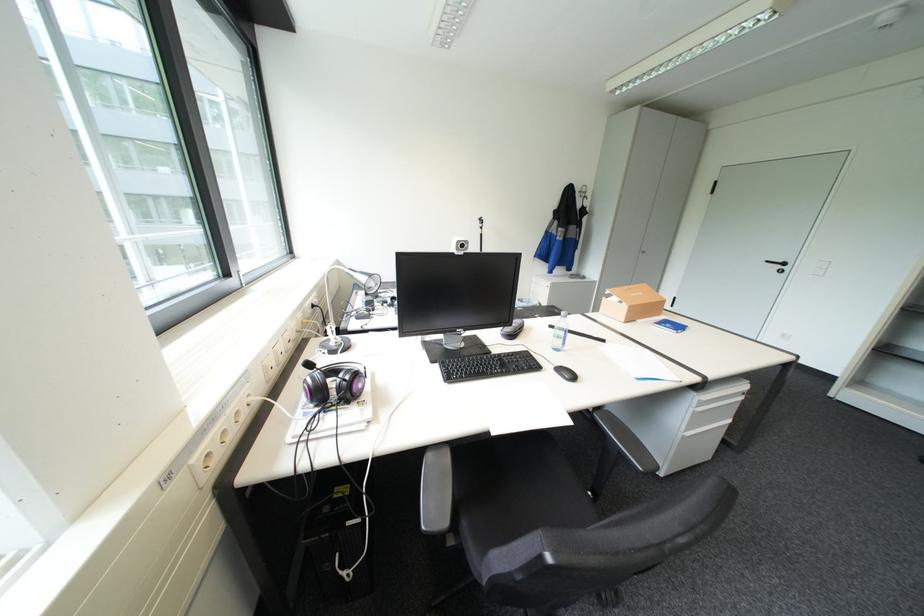
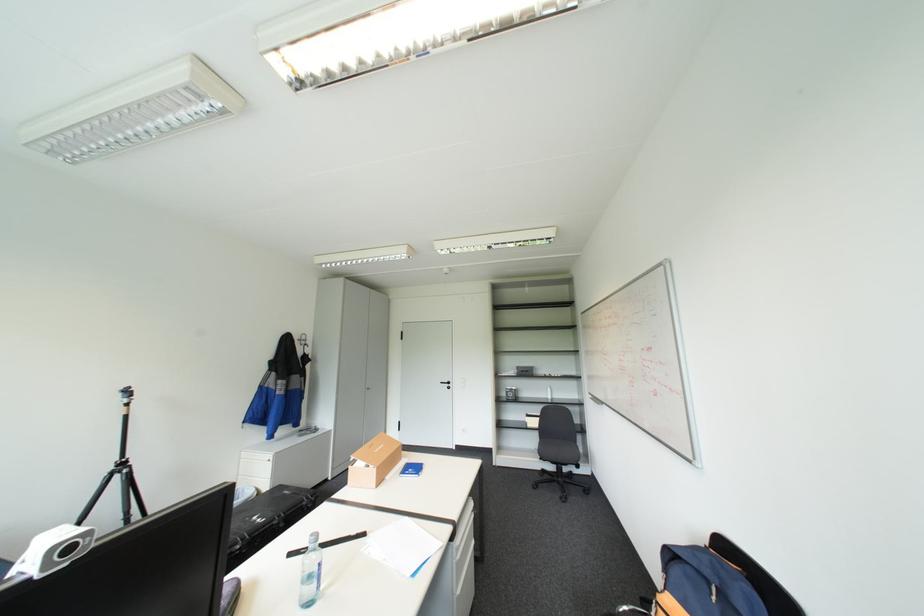
Find the pixel in the second image that matches point 612,297 in the first image.

(358, 464)